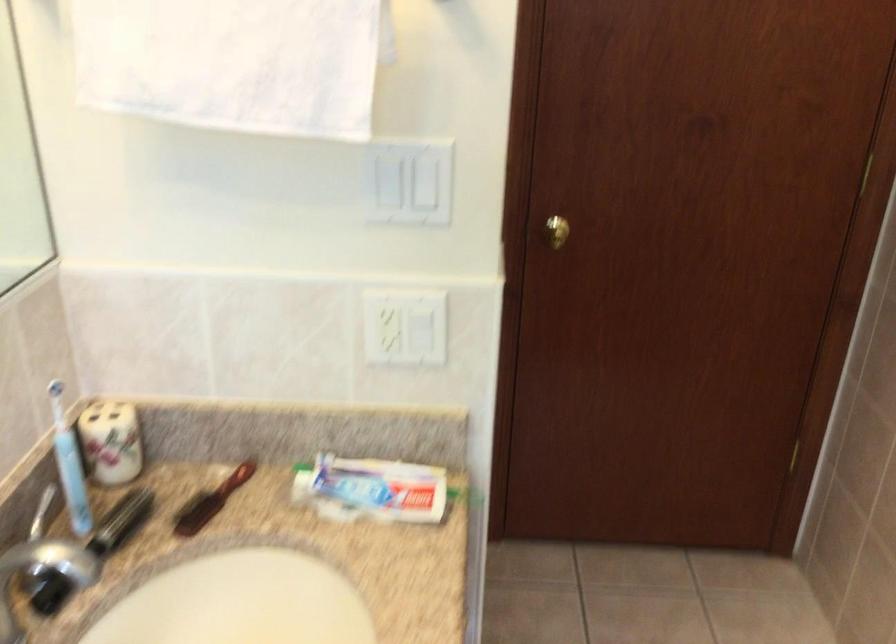
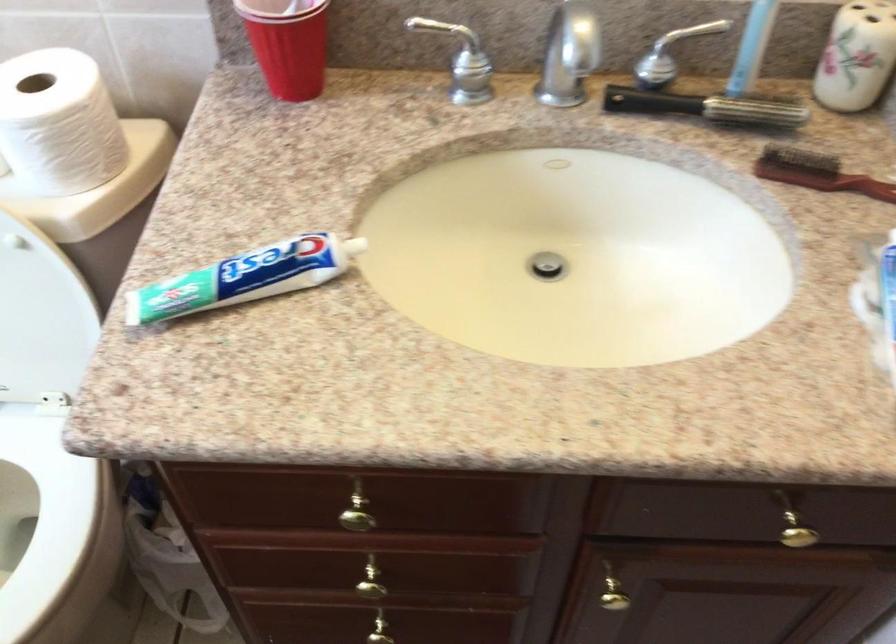
Find the pixel in the second image that matches pixel 99 538 in the first image.

(707, 107)